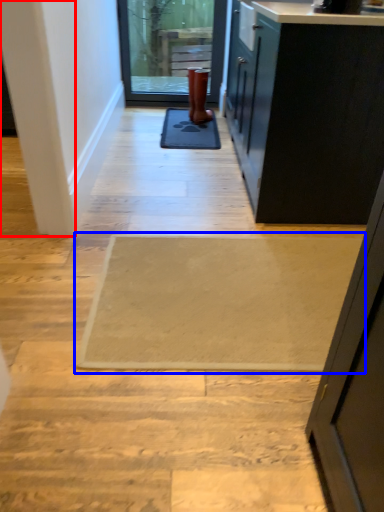
Question: Which point is closer to the camera, pillar (highlighted by a red box) or yoga mat (highlighted by a blue box)?

Choices:
 (A) pillar
 (B) yoga mat

Answer: (A)